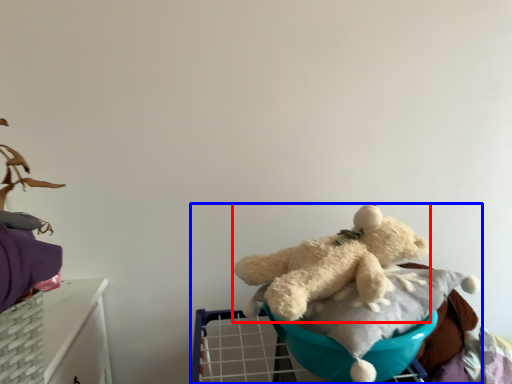
Question: Which of the following is the closest to the observer, teddy bear (highlighted by a red box) or baby carriage (highlighted by a blue box)?

Choices:
 (A) teddy bear
 (B) baby carriage

Answer: (B)